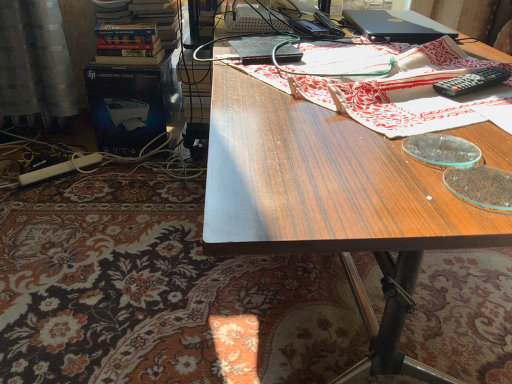
I want to click on blank area to the left of black matte laptop at upper right, so click(316, 34).